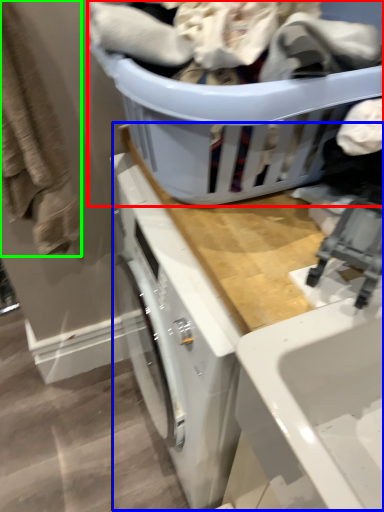
Question: Which object is the closest to the basket (highlighted by a red box)? Choose among these: counter top (highlighted by a blue box) or clothing (highlighted by a green box).

Choices:
 (A) counter top
 (B) clothing

Answer: (A)